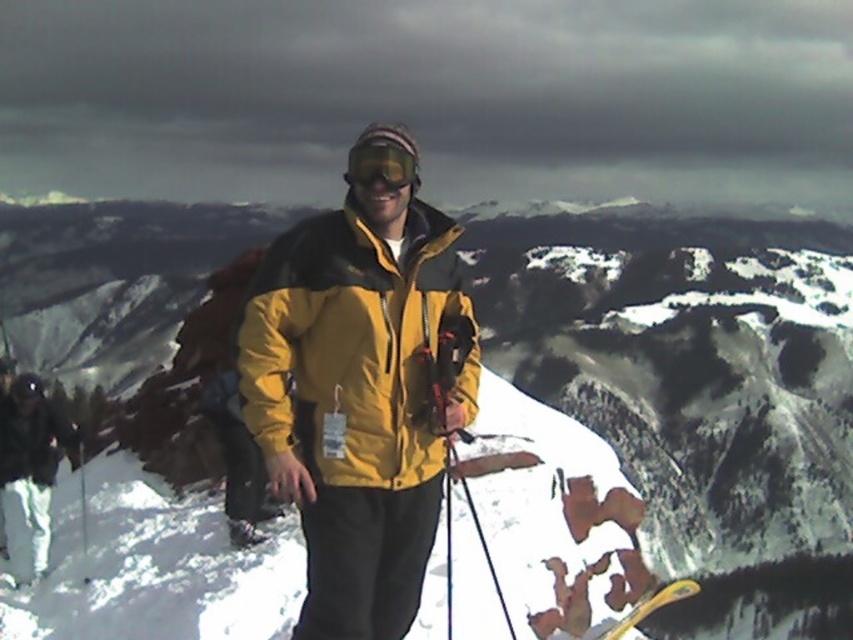
Is yellow matte jacket at center above yellow plastic ski at center?

Yes.

Does yellow matte jacket at center have a lesser width compared to yellow plastic ski at center?

Correct, yellow matte jacket at center's width is less than yellow plastic ski at center's.

Which is in front, point (274, 364) or point (679, 588)?

Positioned in front is point (274, 364).

Find the location of a particular element. This screenshot has width=853, height=640. yellow matte jacket at center is located at coordinates (355, 348).

Is green matte goggles at center below yellow plastic ski at center?

Actually, green matte goggles at center is above yellow plastic ski at center.

Is green matte goggles at center further to camera compared to yellow plastic ski at center?

No.

You are a GUI agent. You are given a task and a screenshot of the screen. Output one action in this format:
    pyautogui.click(x=<x>, y=<y>)
    Task: Click on the green matte goggles at center
    Image resolution: width=853 pixels, height=640 pixels.
    Given the screenshot: What is the action you would take?
    pyautogui.click(x=380, y=163)

You are a GUI agent. You are given a task and a screenshot of the screen. Output one action in this format:
    pyautogui.click(x=<x>, y=<y>)
    Task: Click on the yellow matte jacket at center
    
    Given the screenshot: What is the action you would take?
    pyautogui.click(x=355, y=348)

Is yellow matte jacket at center shorter than green matte goggles at center?

No.

You are a GUI agent. You are given a task and a screenshot of the screen. Output one action in this format:
    pyautogui.click(x=<x>, y=<y>)
    Task: Click on the yellow matte jacket at center
    
    Given the screenshot: What is the action you would take?
    pyautogui.click(x=355, y=348)